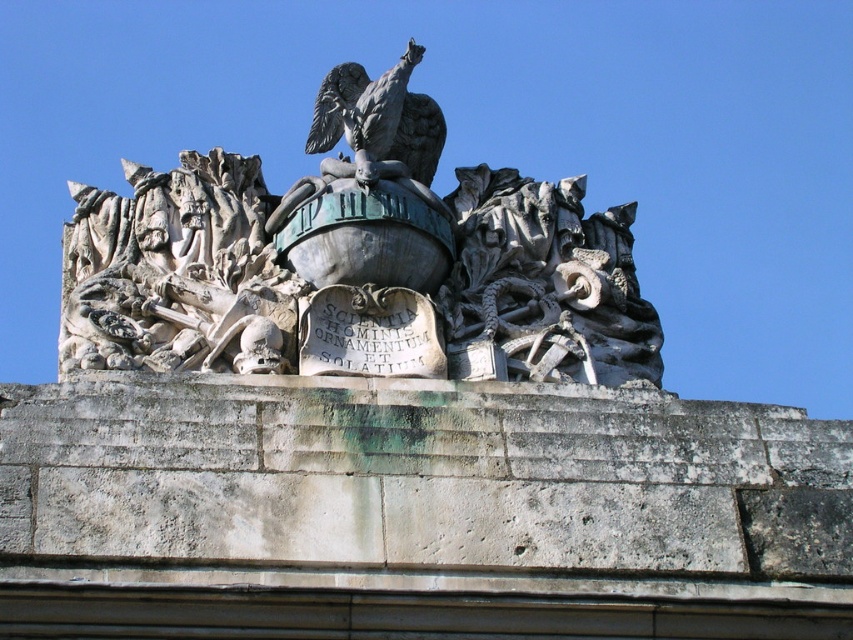
Question: Does stone sculpture at center have a larger size compared to white stone sculpture at upper center?

Choices:
 (A) yes
 (B) no

Answer: (A)

Question: Is stone sculpture at center bigger than bronze eagle at upper center?

Choices:
 (A) no
 (B) yes

Answer: (B)

Question: Among these points, which one is farthest from the camera?

Choices:
 (A) (242, 237)
 (B) (376, 81)

Answer: (B)

Question: Which of these objects is positioned farthest from the white stone sculpture at upper center?

Choices:
 (A) bronze eagle at upper center
 (B) stone sculpture at center

Answer: (A)

Question: Does white stone sculpture at upper center have a greater width compared to bronze eagle at upper center?

Choices:
 (A) yes
 (B) no

Answer: (A)

Question: Which point is farther to the camera?

Choices:
 (A) stone sculpture at center
 (B) white stone sculpture at upper center

Answer: (B)